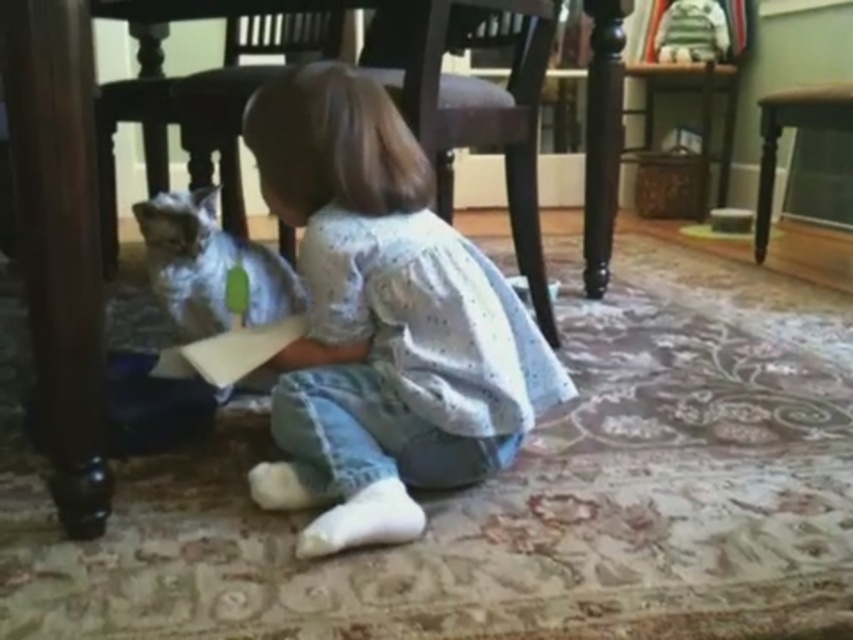
Question: Is dark wood chair at lower center wider than silvery fur cat at lower left?

Choices:
 (A) no
 (B) yes

Answer: (B)

Question: Estimate the real-world distances between objects in this image. Which object is farther from the wooden chair at center?

Choices:
 (A) brown wood chair at center
 (B) white dotted shirt at center
 (C) dark wood chair at lower center

Answer: (B)

Question: Can you confirm if dark wood chair at lower center is positioned to the right of brown wood chair at center?

Choices:
 (A) yes
 (B) no

Answer: (B)

Question: Which is farther from the dark wood chair at lower center?

Choices:
 (A) wooden chair at center
 (B) brown wood chair at center
 (C) wooden stool at lower right

Answer: (C)

Question: Among these objects, which one is farthest from the camera?

Choices:
 (A) silvery fur cat at lower left
 (B) brown wood chair at center
 (C) dark wood chair at lower center
 (D) wooden chair at center

Answer: (D)

Question: Can you confirm if white dotted shirt at center is positioned to the left of brown wood chair at center?

Choices:
 (A) yes
 (B) no

Answer: (A)